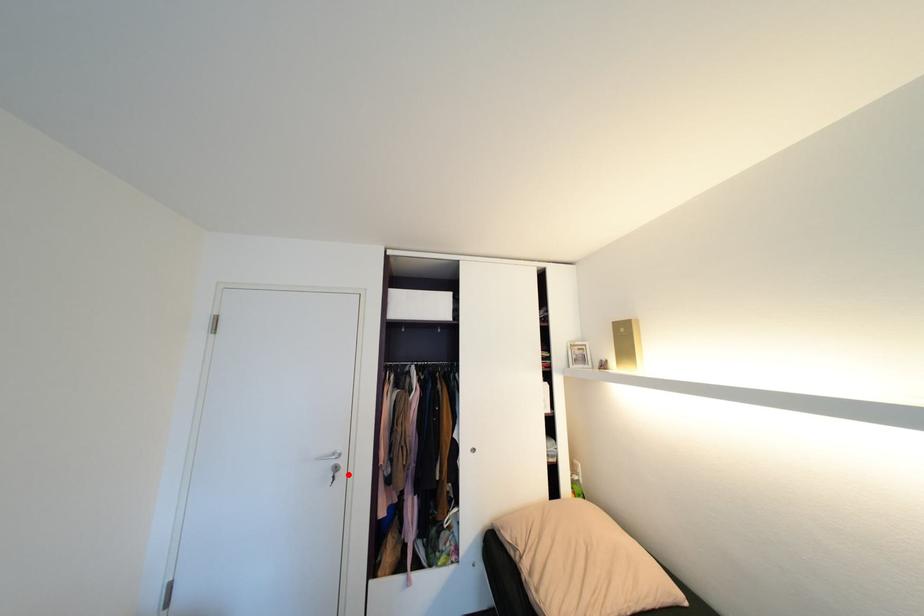
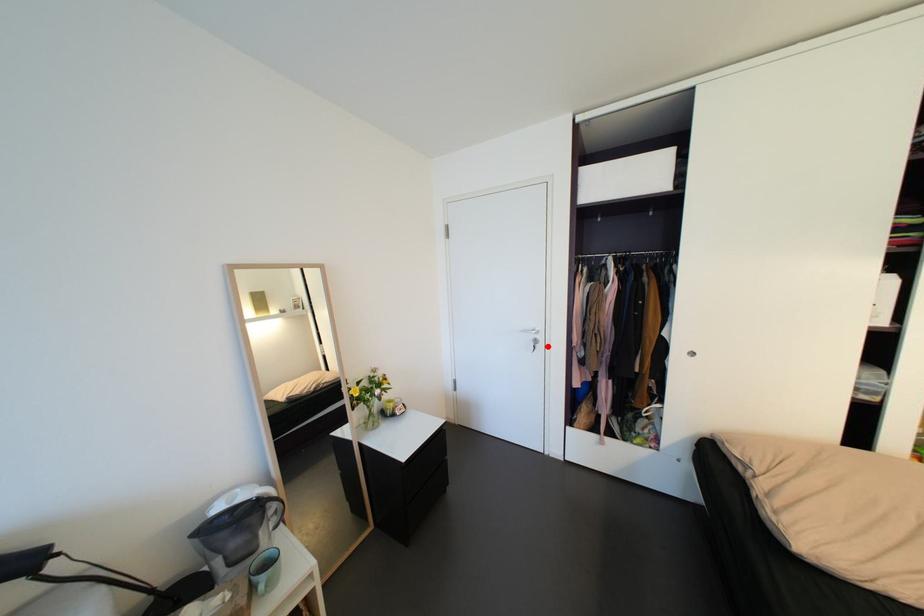
I am providing you with two images of the same scene from different viewpoints. A red point is marked on the first image and another point is marked on the second image. Are the points marked in image1 and image2 representing the same 3D position?

Yes